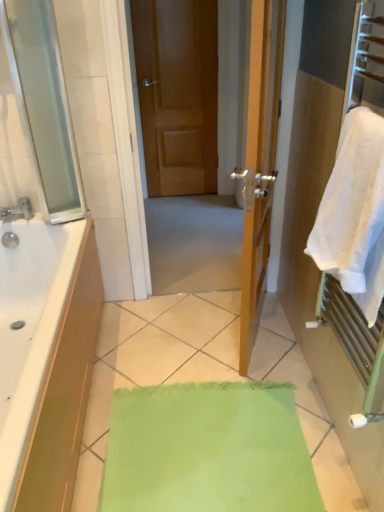
Question: From the image's perspective, does white fluffy towel at right appear lower than brushed metal faucet at left?

Choices:
 (A) yes
 (B) no

Answer: (A)

Question: Does white fluffy towel at right have a greater height compared to brushed metal faucet at left?

Choices:
 (A) no
 (B) yes

Answer: (B)

Question: Is white fluffy towel at right shorter than brushed metal faucet at left?

Choices:
 (A) no
 (B) yes

Answer: (A)

Question: Is white fluffy towel at right turned away from brushed metal faucet at left?

Choices:
 (A) yes
 (B) no

Answer: (B)

Question: Is white fluffy towel at right bigger than brushed metal faucet at left?

Choices:
 (A) yes
 (B) no

Answer: (A)

Question: Is point (14, 217) positioned closer to the camera than point (190, 19)?

Choices:
 (A) farther
 (B) closer

Answer: (B)

Question: Is brushed metal faucet at left inside the boundaries of matte wooden door at center, or outside?

Choices:
 (A) inside
 (B) outside

Answer: (B)

Question: Is brushed metal faucet at left in front of or behind matte wooden door at center in the image?

Choices:
 (A) behind
 (B) front

Answer: (B)

Question: In terms of width, does brushed metal faucet at left look wider or thinner when compared to matte wooden door at center?

Choices:
 (A) wide
 (B) thin

Answer: (A)

Question: Based on their sizes in the image, would you say matte wooden door at center is bigger or smaller than brushed metal faucet at left?

Choices:
 (A) big
 (B) small

Answer: (A)

Question: In terms of height, does matte wooden door at center look taller or shorter compared to brushed metal faucet at left?

Choices:
 (A) tall
 (B) short

Answer: (A)

Question: Is matte wooden door at center to the left or to the right of brushed metal faucet at left in the image?

Choices:
 (A) left
 (B) right

Answer: (B)

Question: Considering the positions of point (188, 142) and point (18, 217), is point (188, 142) closer or farther from the camera than point (18, 217)?

Choices:
 (A) farther
 (B) closer

Answer: (A)

Question: Considering the positions of white fluffy towel at right and brushed metal faucet at left in the image, is white fluffy towel at right taller or shorter than brushed metal faucet at left?

Choices:
 (A) short
 (B) tall

Answer: (B)

Question: In terms of size, does white fluffy towel at right appear bigger or smaller than brushed metal faucet at left?

Choices:
 (A) big
 (B) small

Answer: (A)